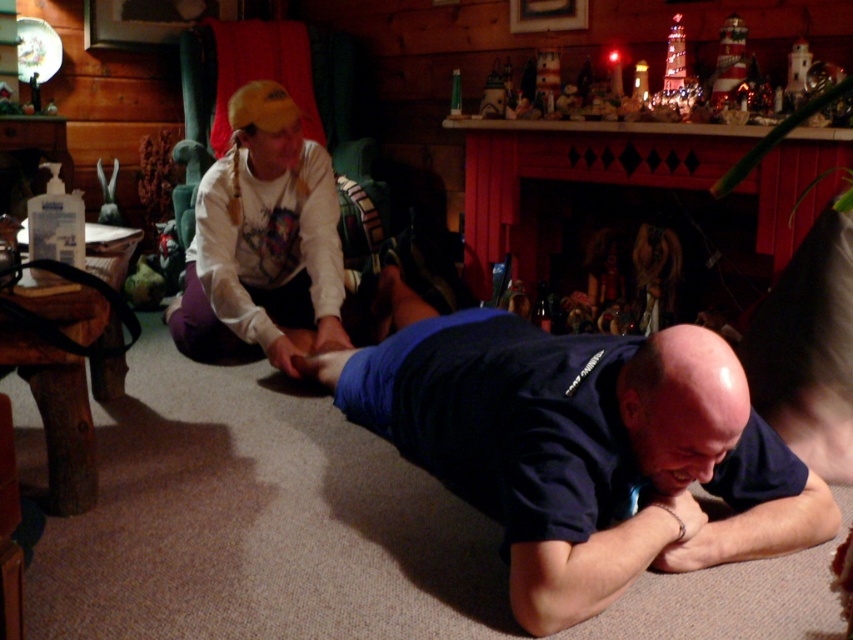
Question: Which of the following is the farthest from the observer?

Choices:
 (A) white cotton shirt at upper left
 (B) dark blue t-shirt at center

Answer: (A)

Question: Which point is farther from the camera taking this photo?

Choices:
 (A) (276, 99)
 (B) (817, 536)

Answer: (A)

Question: Does dark blue t-shirt at center appear over white cotton shirt at upper left?

Choices:
 (A) no
 (B) yes

Answer: (A)

Question: Can you confirm if dark blue t-shirt at center is thinner than white cotton shirt at upper left?

Choices:
 (A) no
 (B) yes

Answer: (A)

Question: Is dark blue t-shirt at center behind white cotton shirt at upper left?

Choices:
 (A) yes
 (B) no

Answer: (B)

Question: Which object appears farthest from the camera in this image?

Choices:
 (A) white cotton shirt at upper left
 (B) dark blue t-shirt at center

Answer: (A)